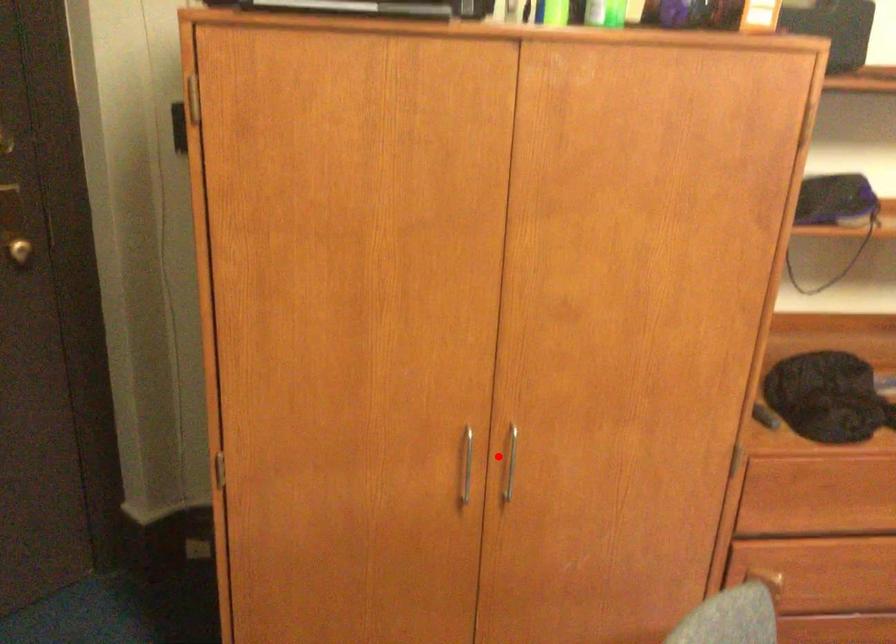
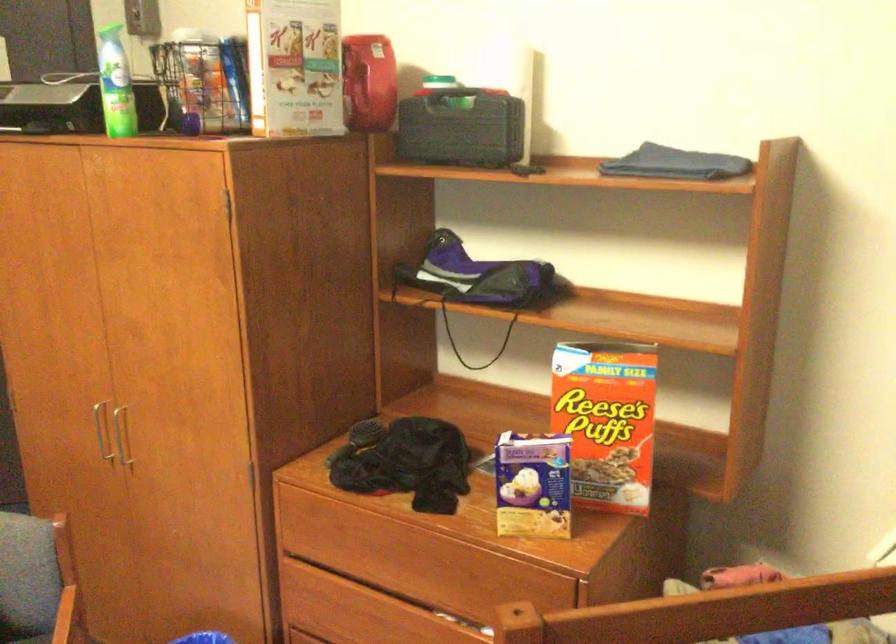
Locate, in the second image, the point that corresponds to the highlighted location in the first image.

(119, 436)